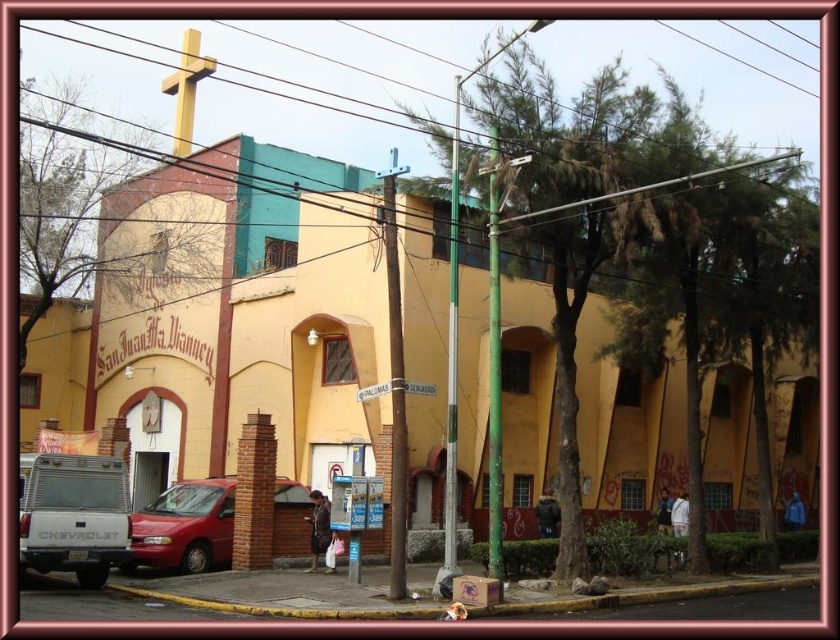
Question: Does yellow matte building at center appear on the left side of matte silver truck at lower left?

Choices:
 (A) yes
 (B) no

Answer: (B)

Question: Is matte silver truck at lower left bigger than metallic red van at lower left?

Choices:
 (A) no
 (B) yes

Answer: (A)

Question: Which is nearer to the yellow matte building at center?

Choices:
 (A) gold metallic cross at upper center
 (B) matte silver truck at lower left
 (C) metallic red van at lower left

Answer: (C)

Question: Is yellow matte building at center wider than gold metallic cross at upper center?

Choices:
 (A) yes
 (B) no

Answer: (A)

Question: Which object appears closest to the camera in this image?

Choices:
 (A) yellow matte building at center
 (B) gold metallic cross at upper center
 (C) metallic red van at lower left

Answer: (A)

Question: Among these objects, which one is nearest to the camera?

Choices:
 (A) yellow matte building at center
 (B) metallic red van at lower left
 (C) matte silver truck at lower left

Answer: (C)